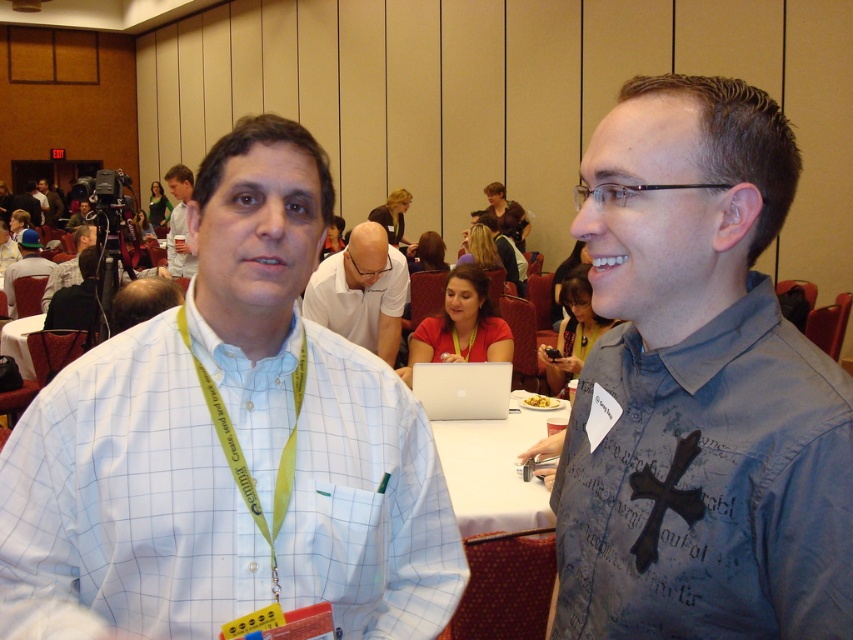
Is point (375, 460) behind point (184, 225)?

That is False.

Is white checkered shirt at center to the right of light blue shirt at upper left from the viewer's perspective?

Correct, you'll find white checkered shirt at center to the right of light blue shirt at upper left.

Identify the location of white checkered shirt at center. The width and height of the screenshot is (853, 640). (229, 445).

Who is more forward, (698, 573) or (35, 250)?

Point (698, 573) is more forward.

Between point (595, 477) and point (38, 240), which one is positioned behind?

The point (38, 240) is behind.

Is point (587, 148) positioned behind point (35, 260)?

No, it is not.

This screenshot has width=853, height=640. I want to click on blue fabric shirt at center, so click(x=698, y=388).

Between point (22, 236) and point (79, 243), which one is positioned in front?

Point (79, 243) is in front.

Is the position of matte black chair at left less distant than that of matte black camera at left?

That is False.

Is point (19, 262) closer to camera compared to point (67, 268)?

No, (19, 262) is further to viewer.

I want to click on matte black chair at left, so click(24, 266).